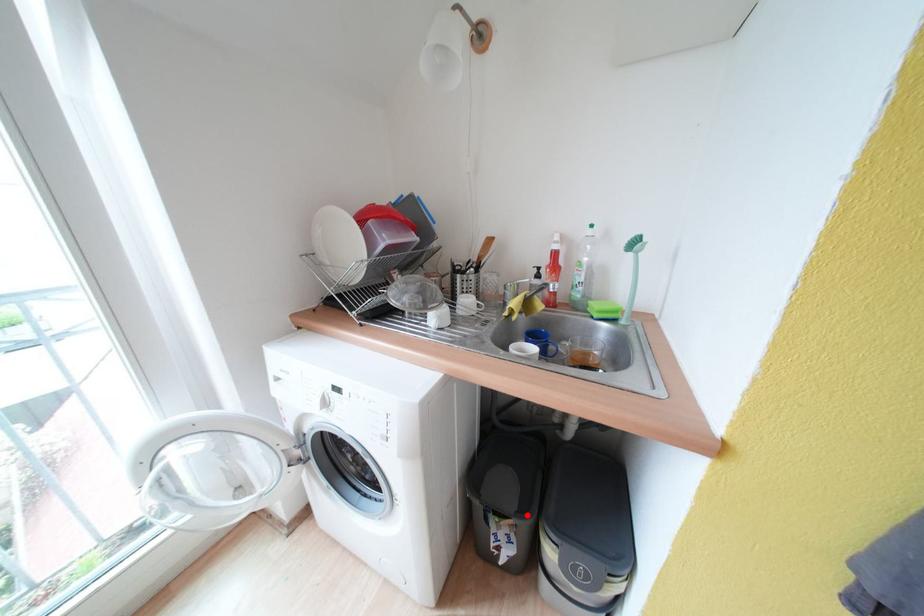
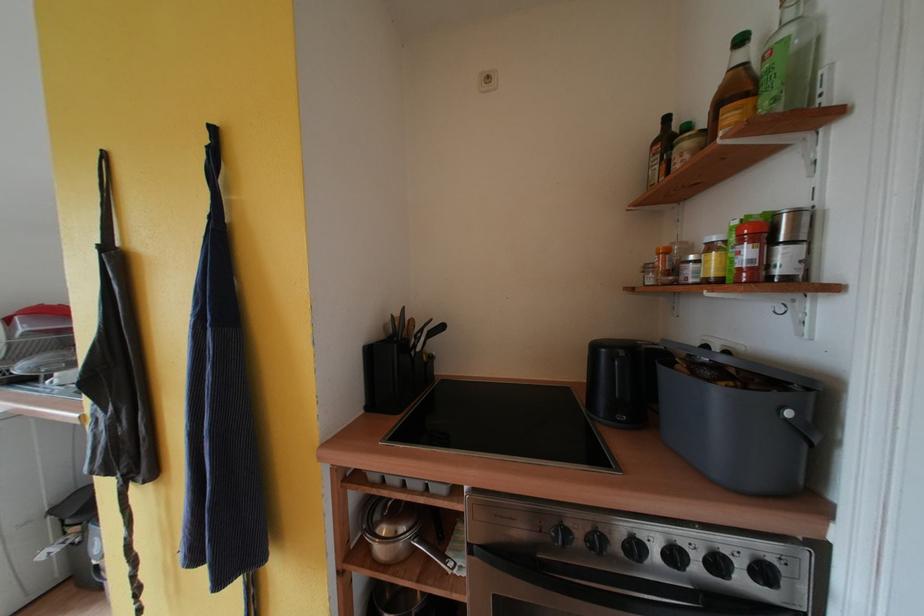
Question: I am providing you with two images of the same scene from different viewpoints. A red point is shown in image1. For the corresponding object point in image2, is it positioned nearer or farther from the camera?

Choices:
 (A) Nearer
 (B) Farther

Answer: (A)